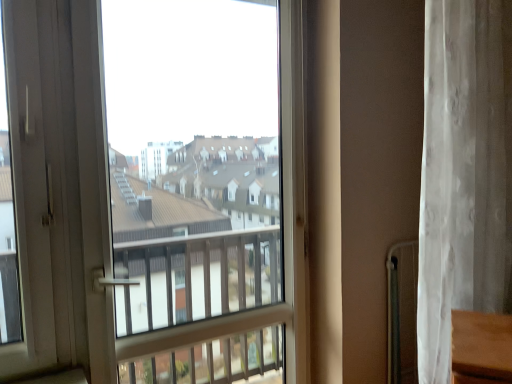
Image resolution: width=512 pixels, height=384 pixels. Find the location of `white plastic screen door at left`. white plastic screen door at left is located at coordinates click(x=42, y=196).

Describe the element at coordinates (464, 173) in the screenshot. This screenshot has height=384, width=512. I see `white sheer curtain at right` at that location.

In order to click on transparent glass window at center in this screenshot , I will do `click(144, 224)`.

Between white plastic screen door at left and white sheer curtain at right, which one has less height?

Standing shorter between the two is white plastic screen door at left.

From the image's perspective, which is below, white plastic screen door at left or white sheer curtain at right?

white plastic screen door at left, from the image's perspective.

Does white plastic screen door at left turn towards white sheer curtain at right?

No, white plastic screen door at left is not turned towards white sheer curtain at right.

Which is correct: white plastic screen door at left is inside white sheer curtain at right, or outside of it?

white plastic screen door at left exists outside the volume of white sheer curtain at right.

Can you tell me how much transparent glass window at center and white plastic screen door at left differ in facing direction?

The facing directions of transparent glass window at center and white plastic screen door at left are 0.0665 degrees apart.

Based on the photo, are transparent glass window at center and white plastic screen door at left far apart?

No, transparent glass window at center is not far away from white plastic screen door at left.

Between transparent glass window at center and white plastic screen door at left, which one has smaller size?

white plastic screen door at left.

Looking at this image, which object is thinner, transparent glass window at center or white sheer curtain at right?

With smaller width is transparent glass window at center.

From the image's perspective, is transparent glass window at center over white sheer curtain at right?

No, from the image's perspective, transparent glass window at center is not over white sheer curtain at right.

Is point (20, 259) positioned after point (419, 279)?

That is False.

From a real-world perspective, which object rests below the other?

transparent glass window at center is physically lower.

Relative to transparent glass window at center, is white plastic screen door at left in front or behind?

In the image, white plastic screen door at left appears in front of transparent glass window at center.

From a real-world perspective, which is physically above, white plastic screen door at left or transparent glass window at center?

white plastic screen door at left is physically above.

Where is `window behind the white plastic screen door at left`? The width and height of the screenshot is (512, 384). window behind the white plastic screen door at left is located at coordinates (144, 224).

Considering the relative sizes of white plastic screen door at left and transparent glass window at center in the image provided, is white plastic screen door at left bigger than transparent glass window at center?

No, white plastic screen door at left is not bigger than transparent glass window at center.

Can you confirm if white sheer curtain at right is positioned to the right of transparent glass window at center?

Indeed, white sheer curtain at right is positioned on the right side of transparent glass window at center.

Is white sheer curtain at right beside transparent glass window at center?

No, white sheer curtain at right is not next to transparent glass window at center.

Does point (447, 285) lie behind point (201, 243)?

No, it is not.

Considering the sizes of objects white sheer curtain at right and white plastic screen door at left in the image provided, who is smaller, white sheer curtain at right or white plastic screen door at left?

With smaller size is white plastic screen door at left.

Which of these two, white sheer curtain at right or white plastic screen door at left, is thinner?

white plastic screen door at left.

From the image's perspective, is white sheer curtain at right below white plastic screen door at left?

No.

Is the position of white sheer curtain at right more distant than that of white plastic screen door at left?

Yes, white sheer curtain at right is further from the camera.

Where is `screen door below the white sheer curtain at right (from the image's perspective)`? screen door below the white sheer curtain at right (from the image's perspective) is located at coordinates click(x=42, y=196).

This screenshot has height=384, width=512. Find the location of `window lying behind the white plastic screen door at left`. window lying behind the white plastic screen door at left is located at coordinates (144, 224).

In the scene shown: Looking at the image, which one is located closer to transparent glass window at center, white plastic screen door at left or white sheer curtain at right?

white plastic screen door at left lies closer to transparent glass window at center than the other object.

When comparing their distances from white plastic screen door at left, does white sheer curtain at right or transparent glass window at center seem further?

white sheer curtain at right is positioned further to the anchor white plastic screen door at left.

Considering their positions, is white plastic screen door at left positioned further to white sheer curtain at right than transparent glass window at center?

The object further to white sheer curtain at right is white plastic screen door at left.

When comparing their distances from transparent glass window at center, does white sheer curtain at right or white plastic screen door at left seem further?

Among the two, white sheer curtain at right is located further to transparent glass window at center.

Looking at the image, which one is located closer to white sheer curtain at right, transparent glass window at center or white plastic screen door at left?

transparent glass window at center lies closer to white sheer curtain at right than the other object.

Considering their positions, is transparent glass window at center positioned closer to white plastic screen door at left than white sheer curtain at right?

The object closer to white plastic screen door at left is transparent glass window at center.

Identify the location of window between white plastic screen door at left and white sheer curtain at right. (144, 224).